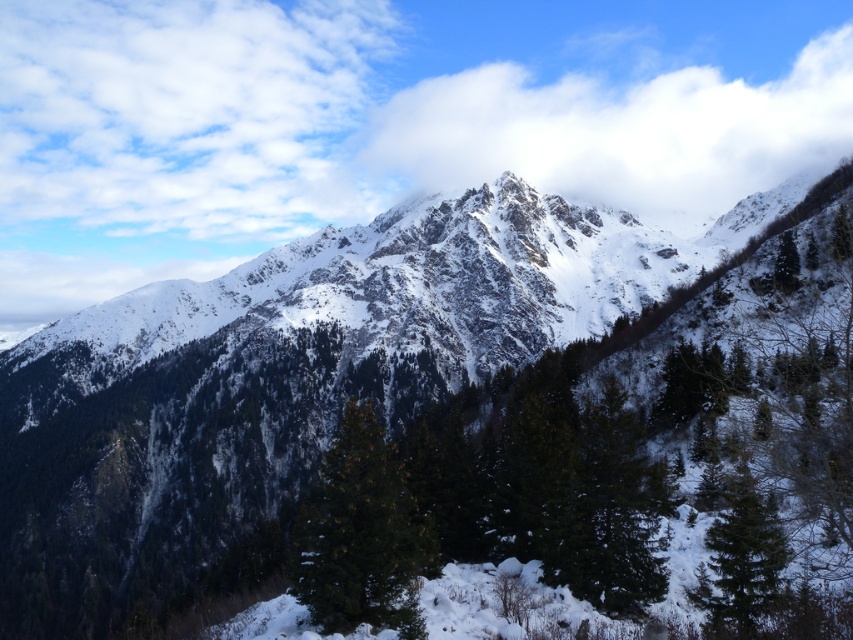
You are planning to take a photo of the green matte tree at center and the white fluffy cloud at upper center. Which object will appear bigger in the photo?

The white fluffy cloud at upper center will appear bigger in the photo because it has a larger size compared to the green matte tree at center.

You are an observer looking at the mountain landscape. You notice the white fluffy cloud at upper center and the green matte tree at lower right. Which object is positioned to the right side of the other?

The white fluffy cloud at upper center is to the right of the green matte tree at lower right.

You are standing at the origin point in the image, which is the bottom left corner. You want to reach the green textured pine tree at center. What are the coordinates of the direction you need to move towards?

The coordinates of the direction you need to move towards are approximately 0.836 in the x direction and 0.426 in the y direction, as the green textured pine tree at center is located at point (363, 534).